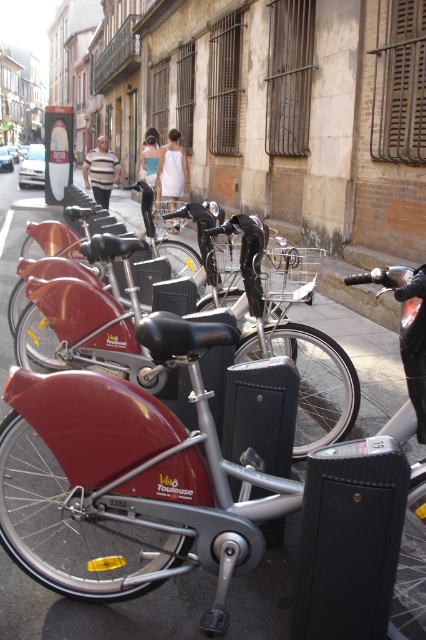
Between matte red bicycle at center and shiny metallic bicycle at center, which one is positioned higher?

Positioned higher is shiny metallic bicycle at center.

Can you confirm if matte red bicycle at center is shorter than shiny metallic bicycle at center?

Indeed, matte red bicycle at center has a lesser height compared to shiny metallic bicycle at center.

Is point (264, 337) more distant than point (126, 198)?

That is False.

Locate an element on the screen. matte red bicycle at center is located at coordinates (310, 380).